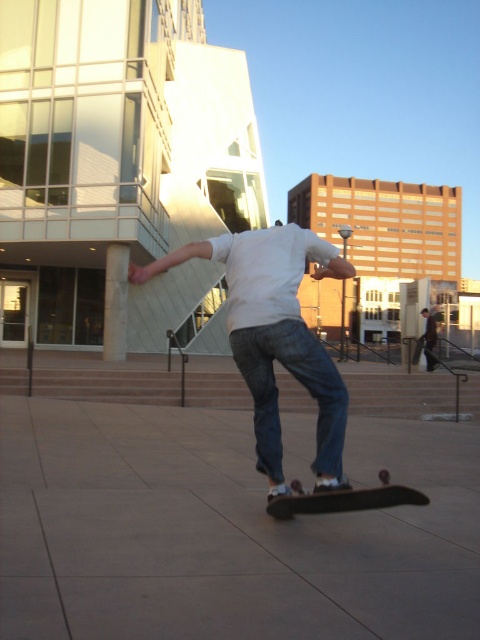
You are a delivery robot positioned at the edge of the gray concrete pavement at center. You need to deliver a package to the black matte skateboard at center. Which direction should you move to reach it?

The gray concrete pavement at center is to the left of the black matte skateboard at center, so you should move to the right to reach the skateboard.

You are a photographer trying to capture the skateboarder in the image. The white cotton shirt at center is represented by point [276,333]. If you want to focus on the shirt, where should you aim your camera? Please provide the coordinates in the format of the point.

The white cotton shirt at center is represented by point [276,333], so you should aim your camera at coordinates [276,333] to focus on the shirt.

You are the skateboarder in the image. You want to place your dark brown leather jacket at center on the gray concrete pavement at center. Is the jacket in the correct position to do so?

The gray concrete pavement at center is in front of the dark brown leather jacket at center, so the jacket is not positioned on the pavement. To place the jacket on the pavement, move it forward so it rests on the gray concrete pavement at center.